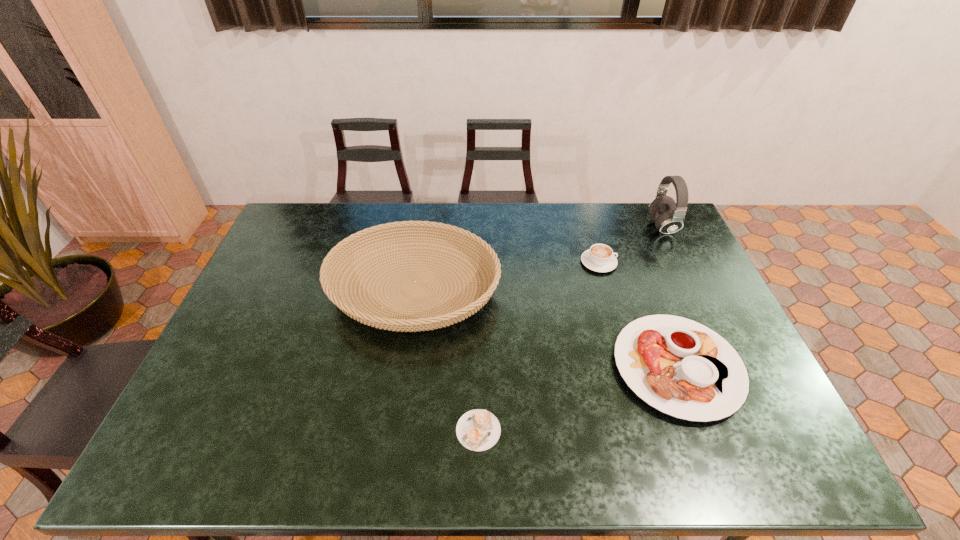
Where is `empty location between the platter and the shorter cappuccino`? This screenshot has height=540, width=960. empty location between the platter and the shorter cappuccino is located at coordinates (578, 399).

Locate an element on the screen. unoccupied position between the platter and the headset is located at coordinates (670, 297).

This screenshot has width=960, height=540. Find the location of `free spot between the taller cappuccino and the farthest object`. free spot between the taller cappuccino and the farthest object is located at coordinates (631, 245).

You are a GUI agent. You are given a task and a screenshot of the screen. Output one action in this format:
    pyautogui.click(x=<x>, y=<y>)
    Task: Click on the free space between the basket and the right cappuccino
    
    Given the screenshot: What is the action you would take?
    pyautogui.click(x=507, y=276)

At what (x,y) coordinates should I click in order to perform the action: click on free space between the nearer cappuccino and the second tallest object. Please return your answer as a coordinate pair (x, y). Looking at the image, I should click on (446, 360).

Locate which object ranks third in proximity to the basket. Please provide its 2D coordinates. Your answer should be formatted as a tuple, i.e. [(x, y)], where the tuple contains the x and y coordinates of a point satisfying the conditions above.

[(682, 368)]

Identify which object is the closest to the farther cappuccino. Please provide its 2D coordinates. Your answer should be formatted as a tuple, i.e. [(x, y)], where the tuple contains the x and y coordinates of a point satisfying the conditions above.

[(669, 217)]

Locate an element on the screen. vacant area that satisfies the following two spatial constraints: 1. on the back side of the shortest object; 2. on the right side of the fourth tallest object is located at coordinates (479, 367).

I want to click on vacant space that satisfies the following two spatial constraints: 1. on the ear cups of the farthest object; 2. on the front side of the platter, so (x=730, y=367).

Where is `free spot that satisfies the following two spatial constraints: 1. on the front side of the fourth shortest object; 2. on the left side of the second shortest object`? The image size is (960, 540). free spot that satisfies the following two spatial constraints: 1. on the front side of the fourth shortest object; 2. on the left side of the second shortest object is located at coordinates (403, 367).